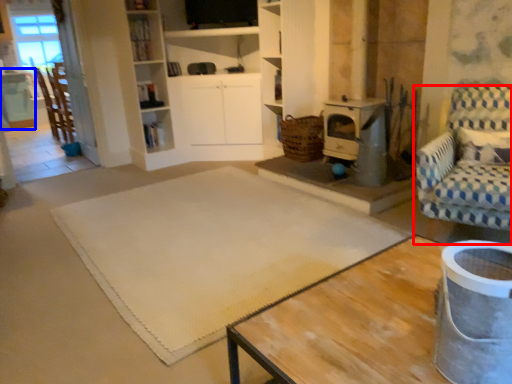
Question: Which object is further to the camera taking this photo, chair (highlighted by a red box) or table (highlighted by a blue box)?

Choices:
 (A) chair
 (B) table

Answer: (B)